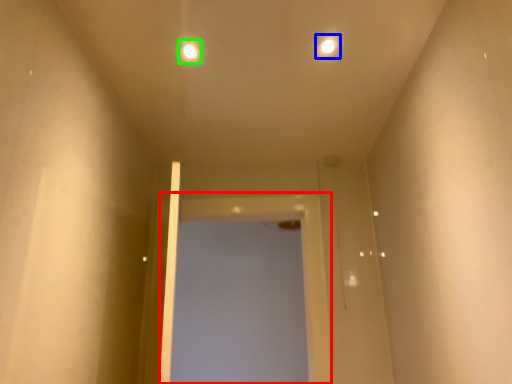
Question: Estimate the real-world distances between objects in this image. Which object is closer to screen door (highlighted by a red box), light (highlighted by a blue box) or light (highlighted by a green box)?

Choices:
 (A) light
 (B) light

Answer: (B)